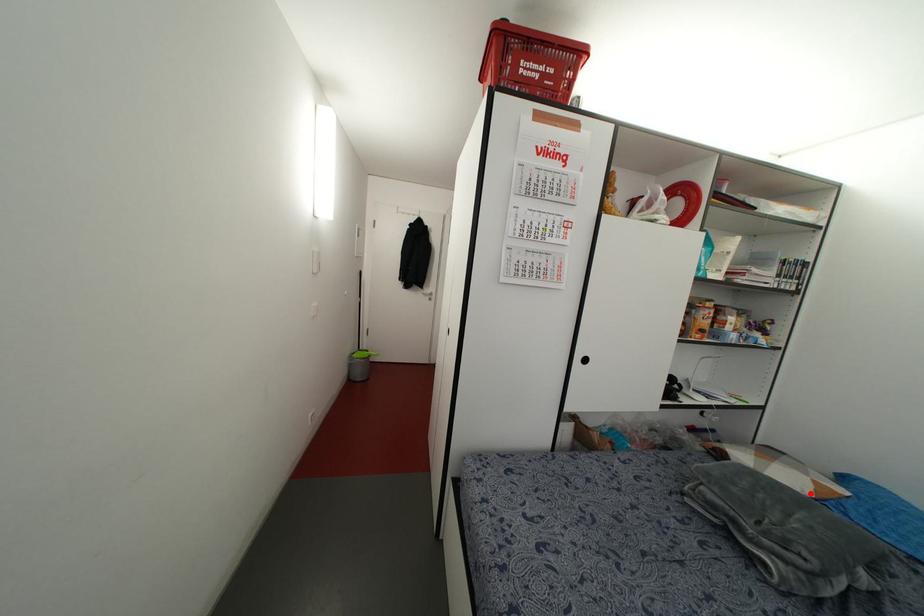
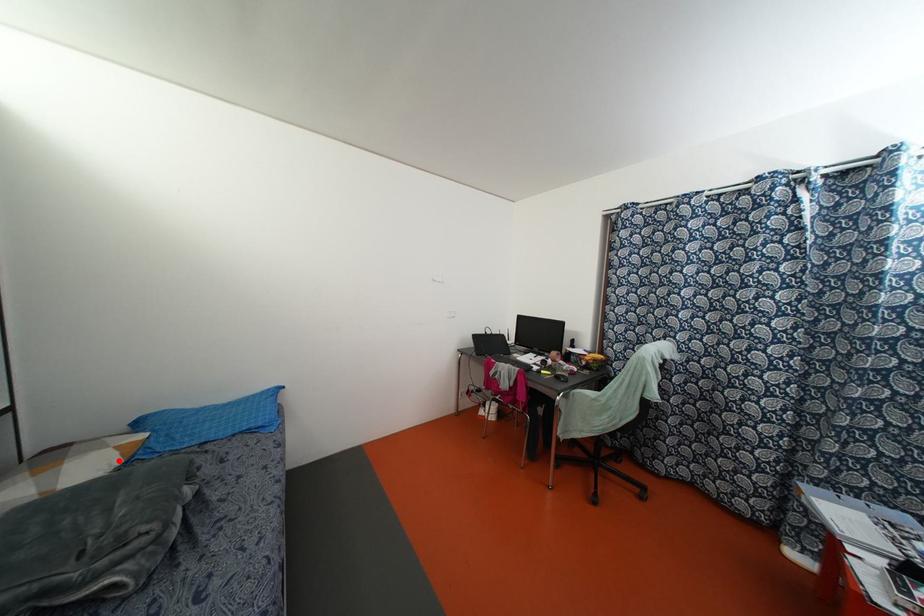
I am providing you with two images of the same scene from different viewpoints. A red point is marked on the first image and another point is marked on the second image. Are the points marked in image1 and image2 representing the same 3D position?

Yes